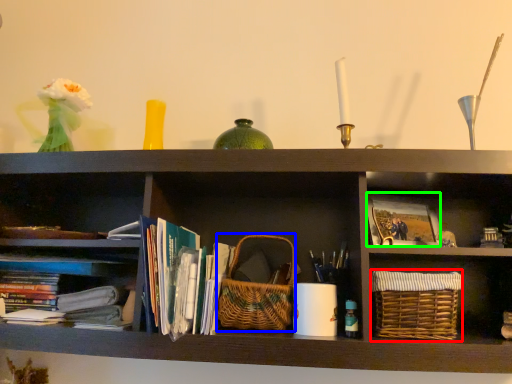
Question: Which is nearer to the basket (highlighted by a red box)? basket (highlighted by a blue box) or paperback book (highlighted by a green box).

Choices:
 (A) basket
 (B) paperback book

Answer: (B)